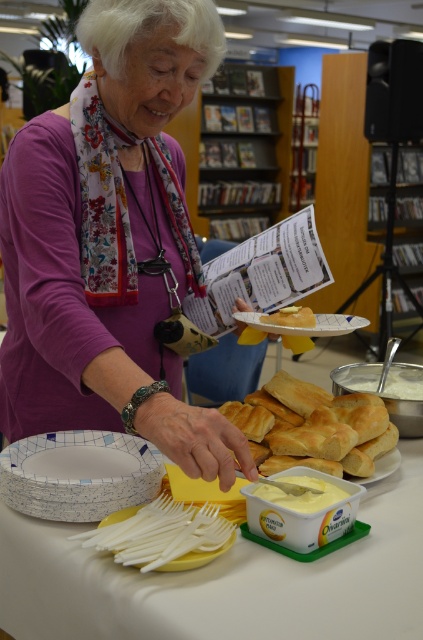
Question: Is white paper plate at center below yellow plastic plate at lower center?

Choices:
 (A) no
 (B) yes

Answer: (A)

Question: Considering the real-world distances, which object is closest to the yellow plastic plate at lower center?

Choices:
 (A) yellow butter at center
 (B) white creamy spread at center
 (C) golden brown bread at center

Answer: (C)

Question: Is golden brown bread at center thinner than white creamy spread at center?

Choices:
 (A) yes
 (B) no

Answer: (B)

Question: Does purple fabric at center have a lesser width compared to white paper plate at center?

Choices:
 (A) no
 (B) yes

Answer: (A)

Question: Among these points, which one is farthest from the camera?

Choices:
 (A) (104, 32)
 (B) (318, 332)

Answer: (B)

Question: Which of the following is the farthest from the observer?

Choices:
 (A) (52, 502)
 (B) (343, 492)
 (C) (291, 332)

Answer: (C)